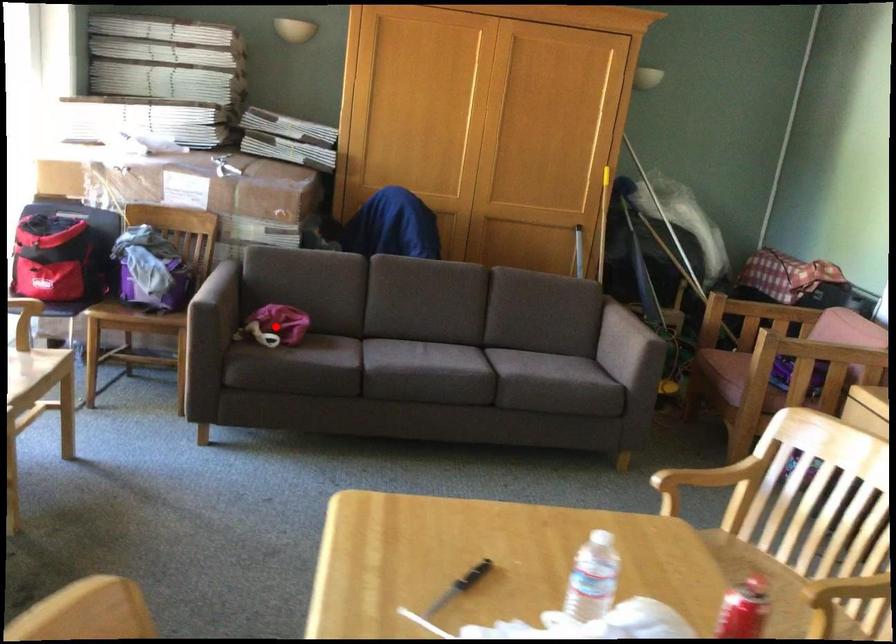
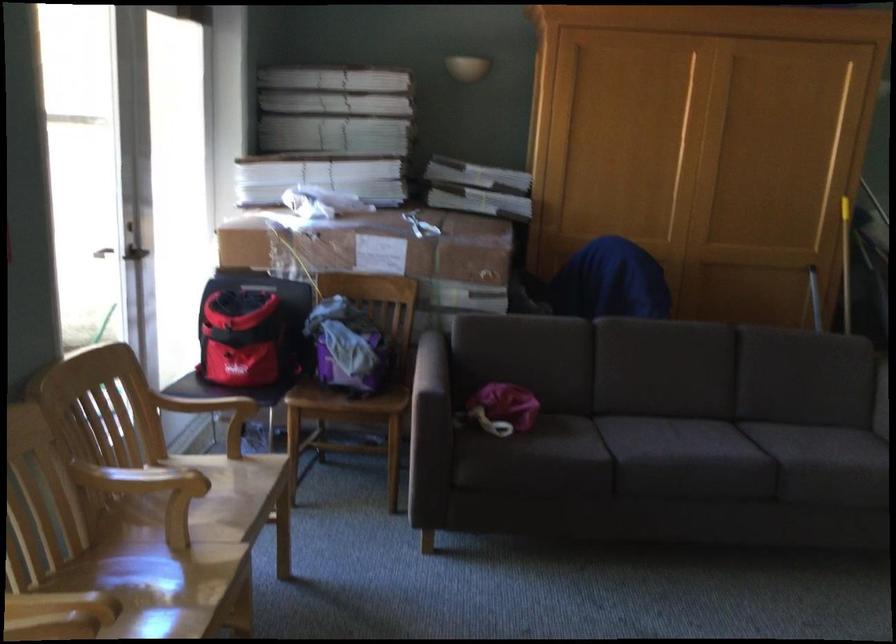
Question: I am providing you with two images of the same scene from different viewpoints. A red point is shown in image1. For the corresponding object point in image2, is it positioned nearer or farther from the camera?

Choices:
 (A) Nearer
 (B) Farther

Answer: (A)